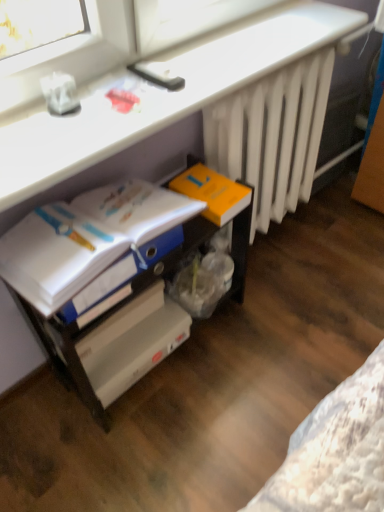
Question: Is the depth of white plastic file cabinet at lower center less than that of blue glossy folder at lower left?

Choices:
 (A) no
 (B) yes

Answer: (A)

Question: Is white plastic file cabinet at lower center facing towards blue glossy folder at lower left?

Choices:
 (A) yes
 (B) no

Answer: (B)

Question: Would you say blue glossy folder at lower left is part of white plastic file cabinet at lower center's contents?

Choices:
 (A) yes
 (B) no

Answer: (A)

Question: Can you confirm if white plastic file cabinet at lower center is smaller than blue glossy folder at lower left?

Choices:
 (A) yes
 (B) no

Answer: (B)

Question: Does white plastic file cabinet at lower center appear on the left side of blue glossy folder at lower left?

Choices:
 (A) no
 (B) yes

Answer: (A)

Question: From a real-world perspective, does white plastic file cabinet at lower center sit lower than blue glossy folder at lower left?

Choices:
 (A) yes
 (B) no

Answer: (A)

Question: Can you confirm if white matte radiator at right is wider than blue glossy folder at lower left?

Choices:
 (A) no
 (B) yes

Answer: (A)

Question: Does white matte radiator at right have a smaller size compared to blue glossy folder at lower left?

Choices:
 (A) yes
 (B) no

Answer: (B)

Question: Is white matte radiator at right thinner than blue glossy folder at lower left?

Choices:
 (A) yes
 (B) no

Answer: (A)

Question: From the image's perspective, is white matte radiator at right over blue glossy folder at lower left?

Choices:
 (A) no
 (B) yes

Answer: (B)

Question: Is white matte radiator at right to the right of blue glossy folder at lower left from the viewer's perspective?

Choices:
 (A) no
 (B) yes

Answer: (B)

Question: From a real-world perspective, is white matte radiator at right on blue glossy folder at lower left?

Choices:
 (A) no
 (B) yes

Answer: (A)

Question: Is orange matte paperback book at center-right wider than blue glossy folder at lower left?

Choices:
 (A) yes
 (B) no

Answer: (B)